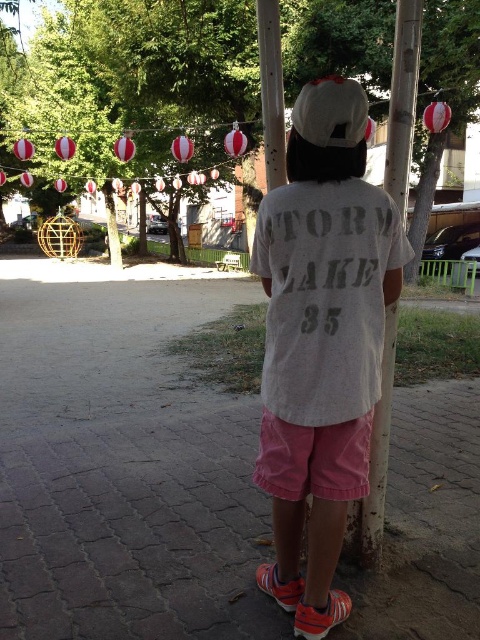
Question: Is green leafy tree at upper center wider than pink cotton shorts at lower center?

Choices:
 (A) yes
 (B) no

Answer: (A)

Question: Is white cotton shirt at center further to camera compared to green leafy tree at upper center?

Choices:
 (A) yes
 (B) no

Answer: (B)

Question: Estimate the real-world distances between objects in this image. Which object is farther from the green leafy tree at upper center?

Choices:
 (A) smooth wood pole at center
 (B) rusty metal pole at center
 (C) white cotton shirt at center
 (D) white matte baseball hat at upper center

Answer: (C)

Question: Which point appears farthest from the camera in this image?

Choices:
 (A) (260, 76)
 (B) (360, 22)
 (C) (349, 476)

Answer: (B)

Question: Which of the following is the farthest from the observer?

Choices:
 (A) rusty metal pole at center
 (B) white matte baseball hat at upper center
 (C) green leafy tree at upper center

Answer: (C)

Question: Is white cotton shirt at center to the right of green leafy tree at upper center from the viewer's perspective?

Choices:
 (A) yes
 (B) no

Answer: (B)